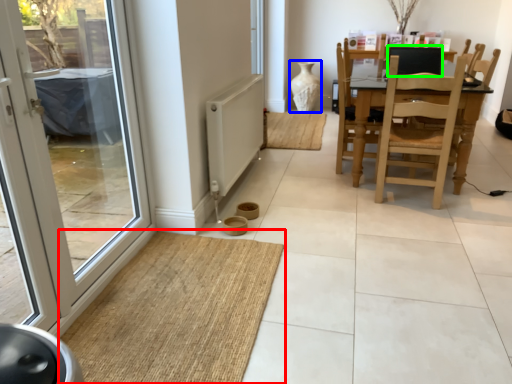
Question: Estimate the real-world distances between objects in this image. Which object is closer to doormat (highlighted by a red box), vase (highlighted by a blue box) or back (highlighted by a green box)?

Choices:
 (A) vase
 (B) back

Answer: (B)